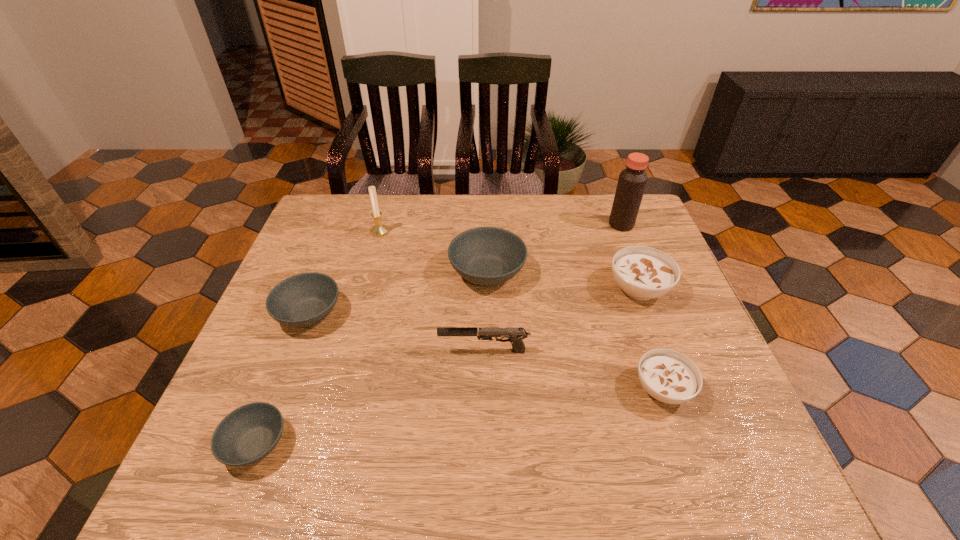
Identify the location of vacant area between the gun and the second tallest object. (432, 291).

Identify the location of free space between the sixth object from right to left and the smaller white soup bowl. (521, 310).

Image resolution: width=960 pixels, height=540 pixels. In order to click on blank region between the biggest gray soup bowl and the second smallest gray soup bowl in this screenshot , I will do `click(398, 293)`.

Locate an element on the screen. This screenshot has width=960, height=540. object that is the second closest to the shortest object is located at coordinates (515, 335).

Locate an element on the screen. the second closest object to the shortest object is located at coordinates (515, 335).

Where is `the third closest soup bowl relative to the second biggest gray soup bowl`? The width and height of the screenshot is (960, 540). the third closest soup bowl relative to the second biggest gray soup bowl is located at coordinates (670, 377).

Locate which soup bowl is the fourth closest to the nearest gray soup bowl. Please provide its 2D coordinates. Your answer should be formatted as a tuple, i.e. [(x, y)], where the tuple contains the x and y coordinates of a point satisfying the conditions above.

[(643, 273)]

You are a GUI agent. You are given a task and a screenshot of the screen. Output one action in this format:
    pyautogui.click(x=<x>, y=<y>)
    Task: Click on the gray soup bowl that is the closest to the candle holder
    The width and height of the screenshot is (960, 540).
    Given the screenshot: What is the action you would take?
    pyautogui.click(x=486, y=256)

At what (x,y) coordinates should I click in order to perform the action: click on the third closest gray soup bowl to the smaller white soup bowl. Please return your answer as a coordinate pair (x, y). The height and width of the screenshot is (540, 960). Looking at the image, I should click on (248, 434).

The image size is (960, 540). In order to click on free space in the image that satisfies the following two spatial constraints: 1. at the muzzle end of the gray gun; 2. on the front side of the nearest gray soup bowl in this screenshot , I will do `click(485, 444)`.